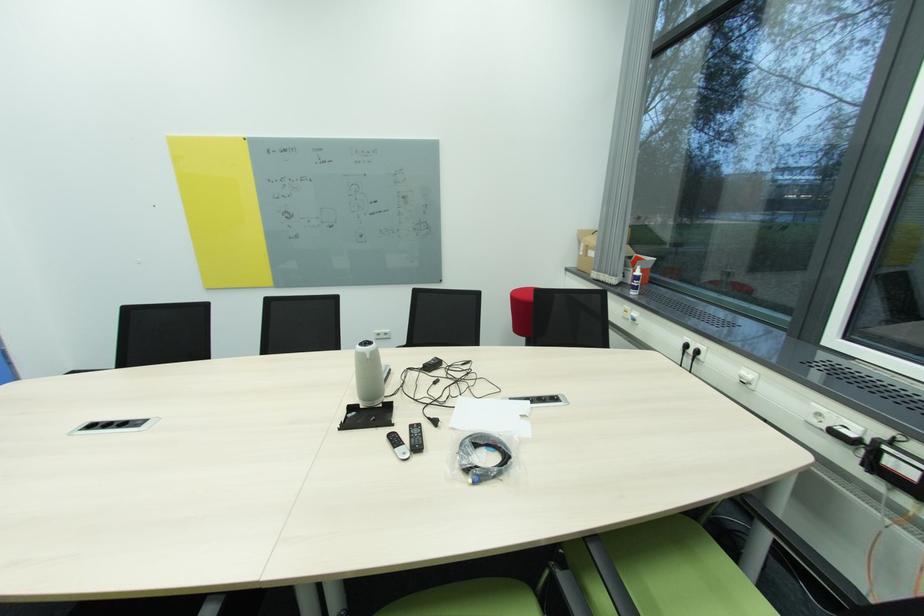
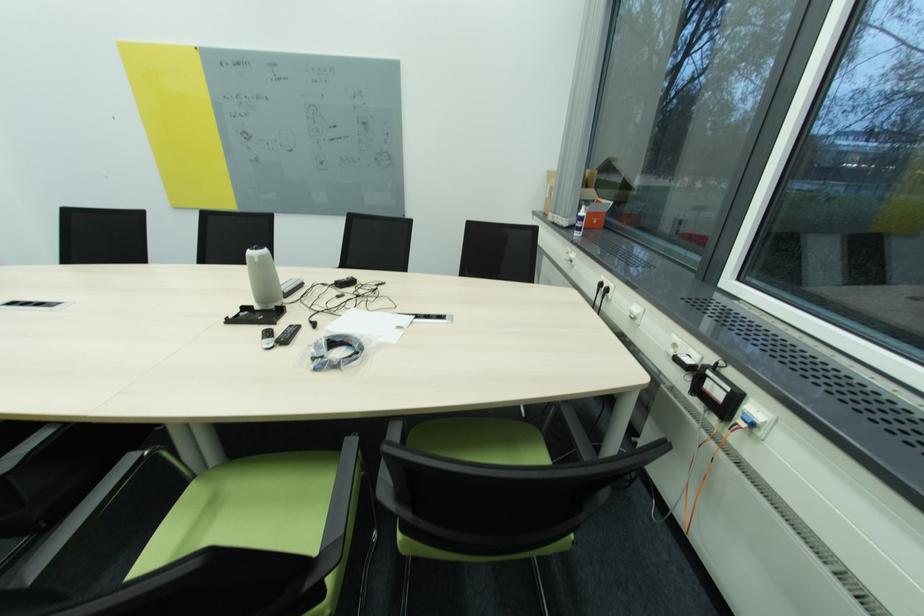
Where in the second image is the point corresponding to (577,265) from the first image?

(544, 209)